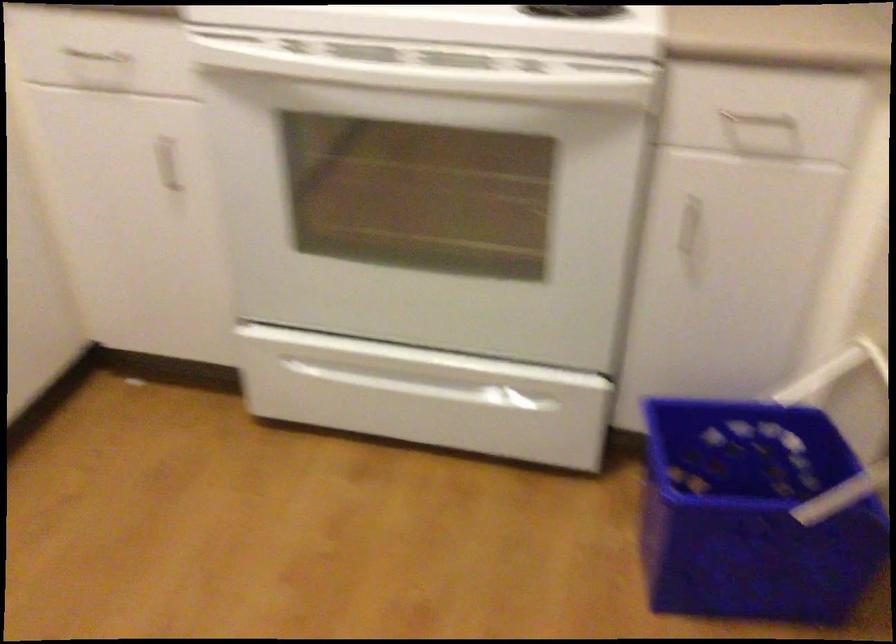
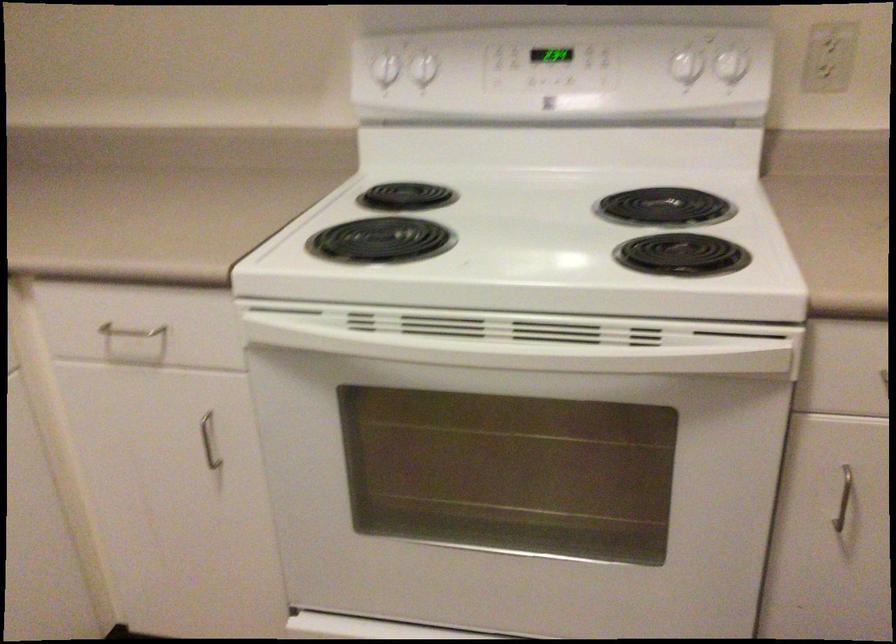
Find the pixel in the second image that matches point 438,79 in the first image.

(526, 339)